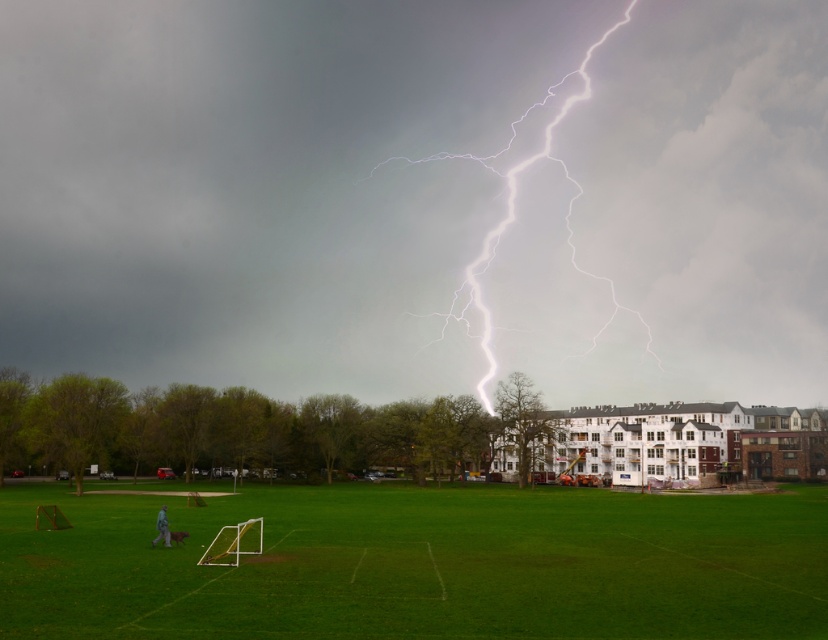
You are a storm chaser who wants to capture the lightning bolt and the grass field in the same photo. Can you fit both the bright white lightning at center and the green grass field at lower center in your camera frame if the lightning is wider than the grass field?

The bright white lightning at center is wider than the green grass field at lower center, so it should be possible to fit both in the camera frame since the lightning is already wider and might occupy more of the central area while the grass field is at the lower part.

You are a photographer trying to capture the lightning strike. You notice the bright white lightning at center and the green grass field at lower center in your viewfinder. Which object appears taller in the photo?

The bright white lightning at center appears taller than the green grass field at lower center in the photo.

You are a photographer trying to capture the lightning strike and the field in the same shot. Based on the scene, where should you position the camera relative to the green grass field at lower center to ensure the bright white lightning at center is visible above it?

Position the camera so that the bright white lightning at center is above the green grass field at lower center, as described in the scene.